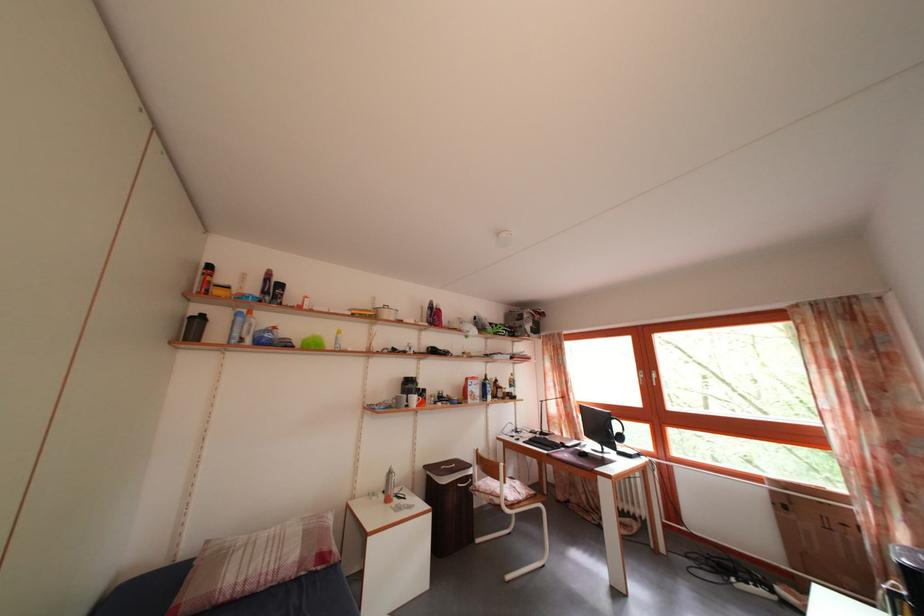
Find the location of a particular element. The width and height of the screenshot is (924, 616). white pot handle is located at coordinates [385, 312].